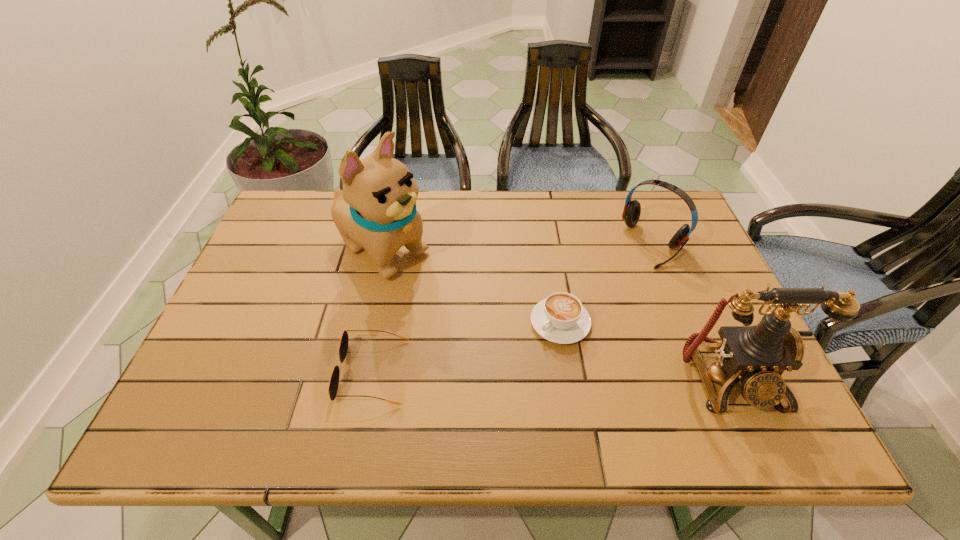
I want to click on headset present at the right edge, so click(632, 209).

Find the location of `object that is at the far right corner`. object that is at the far right corner is located at coordinates (632, 209).

This screenshot has height=540, width=960. Find the location of `object situated at the near right corner`. object situated at the near right corner is located at coordinates click(x=758, y=355).

The image size is (960, 540). What are the coordinates of `vacant space at the far edge of the desktop` in the screenshot? It's located at (437, 231).

This screenshot has height=540, width=960. I want to click on vacant region at the near edge of the desktop, so click(459, 399).

Identify the location of vacant area at the left edge of the desktop. (295, 274).

In the image, there is a desktop. In order to click on vacant region at the right edge in this screenshot , I will do `click(697, 279)`.

The height and width of the screenshot is (540, 960). What are the coordinates of `vacant space at the far left corner` in the screenshot? It's located at (331, 203).

This screenshot has height=540, width=960. I want to click on vacant area that lies between the fourth shortest object and the headset, so click(x=692, y=310).

Identify the location of vacant space that is in between the tallest object and the headset. (517, 247).